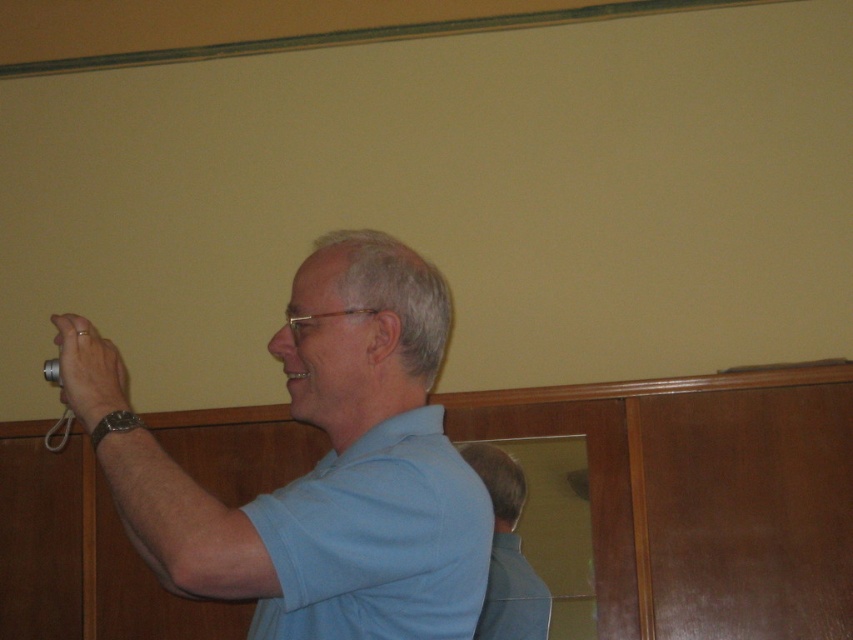
You are a GUI agent. You are given a task and a screenshot of the screen. Output one action in this format:
    pyautogui.click(x=<x>, y=<y>)
    Task: Click on the blue matte shirt at center
    
    Given the screenshot: What is the action you would take?
    pyautogui.click(x=332, y=470)

From the picture: Is blue matte shirt at center to the right of matte silver camera at left from the viewer's perspective?

Yes, blue matte shirt at center is to the right of matte silver camera at left.

Does point (299, 392) come behind point (62, 392)?

That is True.

Where is `blue matte shirt at center`? The height and width of the screenshot is (640, 853). blue matte shirt at center is located at coordinates (332, 470).

Is blue matte shirt at center wider than blue fabric shirt at center?

Correct, the width of blue matte shirt at center exceeds that of blue fabric shirt at center.

Between blue matte shirt at center and blue fabric shirt at center, which one appears on the left side from the viewer's perspective?

Positioned to the left is blue matte shirt at center.

Who is more forward, [299,490] or [496,481]?

Positioned in front is point [299,490].

I want to click on blue matte shirt at center, so click(x=332, y=470).

Between blue fabric shirt at center and matte silver camera at left, which one has less height?

Standing shorter between the two is matte silver camera at left.

Based on the photo, is blue fabric shirt at center to the left of matte silver camera at left from the viewer's perspective?

Incorrect, blue fabric shirt at center is not on the left side of matte silver camera at left.

Which is behind, point (492, 513) or point (73, 333)?

The point (492, 513) is behind.

In order to click on blue fabric shirt at center in this screenshot , I will do `click(508, 552)`.